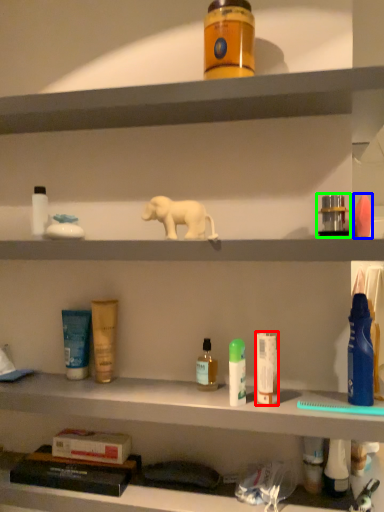
Question: Which object is the closest to the toiletry (highlighted by a red box)? Choose among these: toiletry (highlighted by a blue box) or toiletry (highlighted by a green box).

Choices:
 (A) toiletry
 (B) toiletry

Answer: (B)